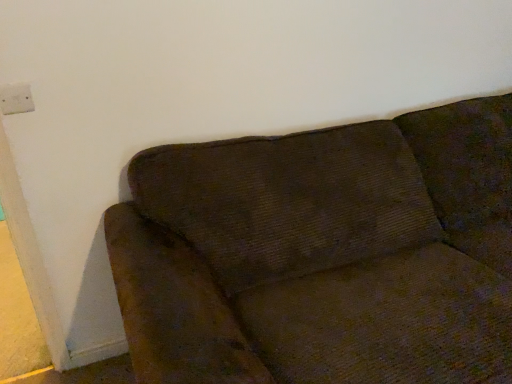
Locate an element on the screen. This screenshot has height=384, width=512. dark corduroy couch at lower right is located at coordinates (323, 254).

Describe the element at coordinates (323, 254) in the screenshot. The width and height of the screenshot is (512, 384). I see `dark corduroy couch at lower right` at that location.

In order to face dark corduroy couch at lower right, should I rotate leftwards or rightwards?

It's best to rotate right around 27.143 degrees.

Find the location of a particular element. The width and height of the screenshot is (512, 384). dark corduroy couch at lower right is located at coordinates (323, 254).